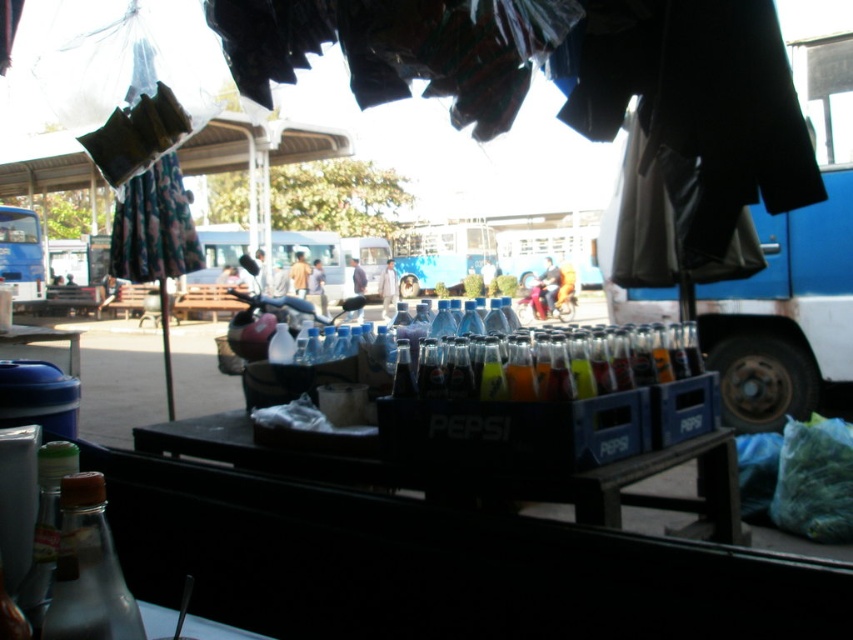
Question: Is transparent glass bottle at lower left thinner than blue matte bus at left?

Choices:
 (A) no
 (B) yes

Answer: (B)

Question: Can you confirm if transparent glass bottle at lower left is positioned to the right of blue matte bus at left?

Choices:
 (A) yes
 (B) no

Answer: (A)

Question: Which object appears farthest from the camera in this image?

Choices:
 (A) metallic blue truck at right
 (B) translucent glass bottle at lower left

Answer: (A)

Question: Considering the relative positions of translucent plastic bottles at center and blue matte bus at left in the image provided, where is translucent plastic bottles at center located with respect to blue matte bus at left?

Choices:
 (A) below
 (B) above

Answer: (A)

Question: Which is farther from the blue matte bus at left?

Choices:
 (A) matte plastic bottle at center
 (B) translucent plastic bottles at center
 (C) transparent glass bottle at lower left

Answer: (C)

Question: Which of these objects is positioned closest to the matte plastic bottle at center?

Choices:
 (A) translucent plastic bottles at center
 (B) metallic blue truck at right
 (C) translucent glass bottle at lower left
 (D) blue matte bus at left

Answer: (B)